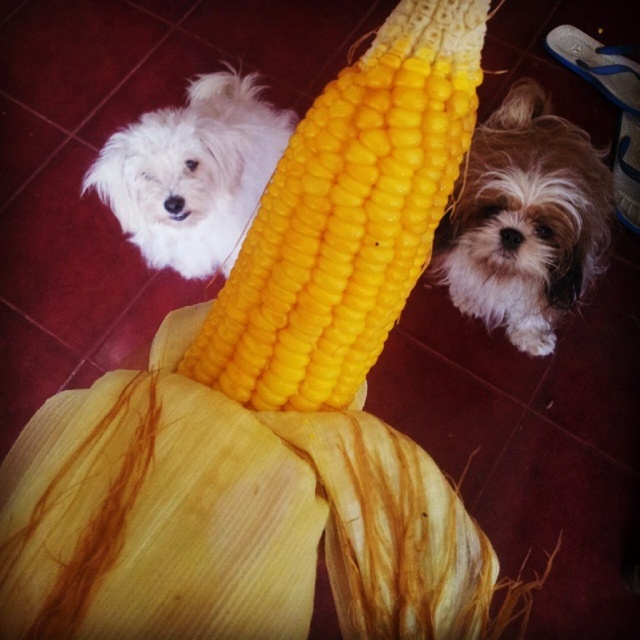
You are a photographer trying to capture a clear shot of both the fuzzy brown dog at lower right and the white fluffy dog at upper left. However, the large ear of corn is blocking your view. Which dog will you need to adjust your camera angle to see better?

The fuzzy brown dog at lower right is in front of the white fluffy dog at upper left, so you will need to adjust your camera angle to see the white fluffy dog at upper left better as it is partially obscured by the corn and the other dog.

You are a photographer trying to capture both the fuzzy brown dog at lower right and the white fluffy dog at upper left in a single shot. Based on their positions, which dog would appear closer to the camera?

The fuzzy brown dog at lower right appears closer to the camera because it is positioned lower in the frame, which typically indicates proximity in photography composition.

You are holding a small toy that you want to place exactly at the point marked as point (305, 545). To ensure accuracy, how far in inches should you place the toy from the camera?

The point (305, 545) is 16.11 inches away from the camera, so you should place the toy 16.11 inches away from the camera.